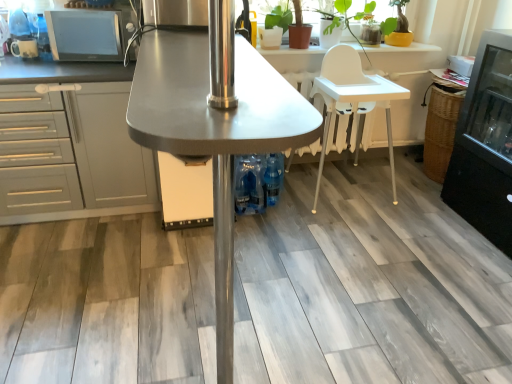
The height and width of the screenshot is (384, 512). In order to click on matte black microwave at upper left, which ranks as the 2th appliance in left-to-right order in this screenshot , I will do `click(88, 34)`.

Describe the element at coordinates (21, 35) in the screenshot. Image resolution: width=512 pixels, height=384 pixels. I see `matte white mug at upper left, arranged as the first appliance when viewed from the left` at that location.

You are a GUI agent. You are given a task and a screenshot of the screen. Output one action in this format:
    pyautogui.click(x=<x>, y=<y>)
    Task: Click on the matte brown pot at upper right
    This screenshot has height=384, width=512.
    Given the screenshot: What is the action you would take?
    pyautogui.click(x=290, y=25)

I want to click on metallic gray table at center, arranged as the 1th table when viewed from the left, so click(x=215, y=134).

Looking at this image, is metallic gray table at center, the 1th table viewed from the front, aimed at gray matte cabinet at left?

No, metallic gray table at center, the 1th table viewed from the front, does not turn towards gray matte cabinet at left.

Consider the image. Considering the relative sizes of metallic gray table at center, arranged as the 1th table when viewed from the left, and gray matte cabinet at left in the image provided, is metallic gray table at center, arranged as the 1th table when viewed from the left, smaller than gray matte cabinet at left?

No, metallic gray table at center, arranged as the 1th table when viewed from the left, is not smaller than gray matte cabinet at left.

Between metallic gray table at center, which ranks as the second table in back-to-front order, and gray matte cabinet at left, which one appears on the right side from the viewer's perspective?

metallic gray table at center, which ranks as the second table in back-to-front order, is more to the right.

In the image, is metallic gray table at center, which ranks as the second table in back-to-front order, positioned in front of or behind gray matte cabinet at left?

metallic gray table at center, which ranks as the second table in back-to-front order, is in front of gray matte cabinet at left.

Does matte white mug at upper left, arranged as the first appliance when viewed from the left, touch metallic gray table at center, which ranks as the second table in back-to-front order?

No, matte white mug at upper left, arranged as the first appliance when viewed from the left, is not in contact with metallic gray table at center, which ranks as the second table in back-to-front order.

From a real-world perspective, is matte white mug at upper left, arranged as the first appliance when viewed from the left, located higher than metallic gray table at center, positioned as the 2th table in right-to-left order?

Yes.

Is matte white mug at upper left, which is counted as the 2th appliance, starting from the right, positioned with its back to metallic gray table at center, arranged as the 1th table when viewed from the left?

That's not correct — matte white mug at upper left, which is counted as the 2th appliance, starting from the right, is not looking away from metallic gray table at center, arranged as the 1th table when viewed from the left.

Considering the positions of point (254, 55) and point (407, 79), is point (254, 55) closer or farther from the camera than point (407, 79)?

Point (254, 55) is closer to the camera than point (407, 79).

Which of these two, metallic gray table at center, the 1th table viewed from the front, or white plastic high chair at center, which is the second table in front-to-back order, is wider?

Wider between the two is metallic gray table at center, the 1th table viewed from the front.

Is metallic gray table at center, which ranks as the second table in back-to-front order, closer to camera compared to white plastic high chair at center, which is the 1th table from right to left?

Yes, metallic gray table at center, which ranks as the second table in back-to-front order, is closer to the viewer.

Considering the sizes of objects metallic gray table at center, positioned as the 2th table in right-to-left order, and white plastic high chair at center, which is the 1th table from right to left, in the image provided, who is smaller, metallic gray table at center, positioned as the 2th table in right-to-left order, or white plastic high chair at center, which is the 1th table from right to left,?

white plastic high chair at center, which is the 1th table from right to left.

Is white plastic chair at center inside matte white mug at upper left, which is counted as the 2th appliance, starting from the right?

Definitely not — white plastic chair at center is not inside matte white mug at upper left, which is counted as the 2th appliance, starting from the right.

Is white plastic chair at center at the back of matte white mug at upper left, arranged as the first appliance when viewed from the left?

No.

Considering the relative sizes of matte white mug at upper left, arranged as the first appliance when viewed from the left, and white plastic chair at center in the image provided, is matte white mug at upper left, arranged as the first appliance when viewed from the left, bigger than white plastic chair at center?

Incorrect, matte white mug at upper left, arranged as the first appliance when viewed from the left, is not larger than white plastic chair at center.

Is matte white mug at upper left, which is counted as the 2th appliance, starting from the right, thinner than white plastic chair at center?

Yes.

From the image's perspective, which is below, gray matte cabinet at left or matte white mug at upper left, arranged as the first appliance when viewed from the left?

gray matte cabinet at left is shown below in the image.

Is matte white mug at upper left, arranged as the first appliance when viewed from the left, at the back of gray matte cabinet at left?

No.

Which object is further away from the camera, gray matte cabinet at left or matte white mug at upper left, which is counted as the 2th appliance, starting from the right?

Positioned behind is matte white mug at upper left, which is counted as the 2th appliance, starting from the right.

Is gray matte cabinet at left not close to matte white mug at upper left, which is counted as the 2th appliance, starting from the right?

No, gray matte cabinet at left is not far away from matte white mug at upper left, which is counted as the 2th appliance, starting from the right.

Which object is wider, blue plastic bottles at center or gray matte cabinet at left?

gray matte cabinet at left is wider.

Identify the location of cabinetry on the left of blue plastic bottles at center. (71, 155).

From the image's perspective, is blue plastic bottles at center located beneath gray matte cabinet at left?

Correct, blue plastic bottles at center appears lower than gray matte cabinet at left in the image.

Is blue plastic bottles at center to the right of gray matte cabinet at left from the viewer's perspective?

Yes.

Does blue plastic bottles at center have a lesser width compared to white plastic chair at center?

Yes, blue plastic bottles at center is thinner than white plastic chair at center.

Is blue plastic bottles at center in front of white plastic chair at center?

No, blue plastic bottles at center is behind white plastic chair at center.

Is point (269, 196) closer or farther from the camera than point (330, 53)?

Point (269, 196) is closer to the camera than point (330, 53).

Is blue plastic bottles at center positioned with its back to white plastic chair at center?

That's not correct — blue plastic bottles at center is not looking away from white plastic chair at center.

This screenshot has height=384, width=512. I want to click on the 1st table counting from the right of the gray matte cabinet at left, so click(x=215, y=134).

Find the location of a particular element. Image resolution: width=512 pixels, height=384 pixels. appliance that is the 2nd one above the metallic gray table at center, the 1th table viewed from the front (from a real-world perspective) is located at coordinates (21, 35).

Looking at the image, which one is located further to metallic gray table at center, the 1th table viewed from the front, matte brown pot at upper right or matte white mug at upper left, which is counted as the 2th appliance, starting from the right?

Based on the image, matte brown pot at upper right appears to be further to metallic gray table at center, the 1th table viewed from the front.

Considering their positions, is gray matte cabinet at left positioned further to matte white mug at upper left, arranged as the first appliance when viewed from the left, than blue plastic bottles at center?

The object further to matte white mug at upper left, arranged as the first appliance when viewed from the left, is blue plastic bottles at center.

When comparing their distances from gray matte cabinet at left, does metallic gray table at center, positioned as the 2th table in right-to-left order, or matte white mug at upper left, arranged as the first appliance when viewed from the left, seem further?

metallic gray table at center, positioned as the 2th table in right-to-left order, is further to gray matte cabinet at left.

Which object lies further to the anchor point metallic gray table at center, arranged as the 1th table when viewed from the left, white plastic high chair at center, which ranks as the 2th table in left-to-right order, or blue plastic bottles at center?

white plastic high chair at center, which ranks as the 2th table in left-to-right order.

From the image, which object appears to be farther from matte black microwave at upper left, which ranks as the 2th appliance in left-to-right order, white plastic high chair at center, which ranks as the 2th table in left-to-right order, or metallic gray table at center, the 1th table viewed from the front?

white plastic high chair at center, which ranks as the 2th table in left-to-right order, is further to matte black microwave at upper left, which ranks as the 2th appliance in left-to-right order.

Estimate the real-world distances between objects in this image. Which object is closer to white plastic high chair at center, which is the 1th table from right to left, matte black microwave at upper left, which is counted as the first appliance, starting from the right, or blue plastic bottles at center?

blue plastic bottles at center lies closer to white plastic high chair at center, which is the 1th table from right to left, than the other object.

Estimate the real-world distances between objects in this image. Which object is further from blue plastic bottles at center, white plastic high chair at center, which is the second table in front-to-back order, or gray matte cabinet at left?

Among the two, white plastic high chair at center, which is the second table in front-to-back order, is located further to blue plastic bottles at center.

From the picture: Based on their spatial positions, is metallic gray table at center, the 1th table viewed from the front, or gray matte cabinet at left closer to white plastic high chair at center, which is the 1th table from right to left?

gray matte cabinet at left is closer to white plastic high chair at center, which is the 1th table from right to left.

At what (x,y) coordinates should I click in order to perform the action: click on appliance between gray matte cabinet at left and white plastic high chair at center, which is the 1th table from right to left. Please return your answer as a coordinate pair (x, y). Looking at the image, I should click on (88, 34).

This screenshot has height=384, width=512. I want to click on plant between gray matte cabinet at left and white plastic chair at center, so click(290, 25).

What are the coordinates of `plant between gray matte cabinet at left and white plastic high chair at center, positioned as the first table in back-to-front order, from left to right` in the screenshot? It's located at tap(290, 25).

This screenshot has width=512, height=384. What are the coordinates of `bottle situated between matte black microwave at upper left, which ranks as the 2th appliance in left-to-right order, and white plastic high chair at center, positioned as the first table in back-to-front order, from left to right` in the screenshot? It's located at (272, 181).